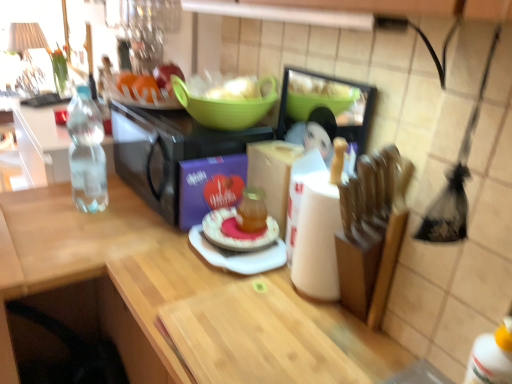
The width and height of the screenshot is (512, 384). Describe the element at coordinates (87, 153) in the screenshot. I see `clear plastic bottle at left` at that location.

From the picture: In order to face wooden cutting board at center, acting as the first appliance starting from the right, should I rotate leftwards or rightwards?

You should look right and rotate roughly 7.252 degrees.

Identify the location of green plastic bowl at upper center. (224, 108).

Describe the element at coordinates (242, 224) in the screenshot. I see `pink glossy plate at center` at that location.

What do you see at coordinates (95, 277) in the screenshot?
I see `wooden cutting board at center` at bounding box center [95, 277].

At what (x,y) coordinates should I click in order to perform the action: click on clear plastic bottle at left. Please return your answer as a coordinate pair (x, y). The width and height of the screenshot is (512, 384). Looking at the image, I should click on (87, 153).

Considering the positions of objects clear plastic bottle at left and wooden cutting board at center, acting as the first appliance starting from the right, in the image provided, who is more to the left, clear plastic bottle at left or wooden cutting board at center, acting as the first appliance starting from the right,?

clear plastic bottle at left is more to the left.

Identify the location of bottle beneath the wooden cutting board at center, acting as the second appliance starting from the left (from a real-world perspective). This screenshot has height=384, width=512. point(87,153).

Can you confirm if clear plastic bottle at left is bigger than wooden cutting board at center, acting as the second appliance starting from the left?

Correct, clear plastic bottle at left is larger in size than wooden cutting board at center, acting as the second appliance starting from the left.

Measure the distance from clear plastic bottle at left to wooden cutting board at center, acting as the first appliance starting from the right.

The distance of clear plastic bottle at left from wooden cutting board at center, acting as the first appliance starting from the right, is 23.27 inches.

Consider the image. Could you tell me if wooden cutting board at center, acting as the first appliance starting from the right, is turned towards wooden cutting board at center?

No, wooden cutting board at center, acting as the first appliance starting from the right, is not oriented towards wooden cutting board at center.

From the image's perspective, relative to wooden cutting board at center, is wooden cutting board at center, acting as the first appliance starting from the right, above or below?

Clearly, from the image's perspective, wooden cutting board at center, acting as the first appliance starting from the right, is above wooden cutting board at center.

Considering the relative sizes of wooden cutting board at center, acting as the second appliance starting from the left, and wooden cutting board at center in the image provided, is wooden cutting board at center, acting as the second appliance starting from the left, bigger than wooden cutting board at center?

No, wooden cutting board at center, acting as the second appliance starting from the left, is not bigger than wooden cutting board at center.

From the wooden cutting board at center, count 2nd appliance to the right and point to it. Please provide its 2D coordinates.

[(325, 112)]

Looking at this image, from the image's perspective, would you say wooden cutting board at center is shown under black matte microwave at center, which is counted as the first appliance, starting from the left?

Indeed, from the image's perspective, wooden cutting board at center is shown beneath black matte microwave at center, which is counted as the first appliance, starting from the left.

Looking at the image, does wooden cutting board at center seem bigger or smaller compared to black matte microwave at center, which is counted as the first appliance, starting from the left?

wooden cutting board at center is bigger than black matte microwave at center, which is counted as the first appliance, starting from the left.

Are wooden cutting board at center and black matte microwave at center, which is the second appliance in right-to-left order, located far from each other?

No, wooden cutting board at center is not far away from black matte microwave at center, which is the second appliance in right-to-left order.

Does point (149, 284) lie in front of point (172, 144)?

Yes.

How different are the orientations of pink glossy plate at center and clear plastic bottle at left in degrees?

The angle between the facing direction of pink glossy plate at center and the facing direction of clear plastic bottle at left is 87.2 degrees.

Is the position of pink glossy plate at center less distant than that of clear plastic bottle at left?

Yes, the depth of pink glossy plate at center is less than that of clear plastic bottle at left.

Is pink glossy plate at center shorter than clear plastic bottle at left?

Yes.

From a real-world perspective, is pink glossy plate at center over clear plastic bottle at left?

Incorrect, from a real-world perspective, pink glossy plate at center is lower than clear plastic bottle at left.

What's the angular difference between green plastic bowl at upper center and clear plastic bottle at left's facing directions?

green plastic bowl at upper center and clear plastic bottle at left are facing 90 degrees away from each other.

Is point (191, 101) closer or farther from the camera than point (77, 130)?

Point (191, 101) is closer to the camera than point (77, 130).

From a real-world perspective, which object rests below the other?

In real-world perspective, clear plastic bottle at left is lower.

Is green plastic bowl at upper center behind clear plastic bottle at left?

No, it is not.

From the image's perspective, is black matte microwave at center, which is counted as the first appliance, starting from the left, located beneath clear plastic bottle at left?

Indeed, from the image's perspective, black matte microwave at center, which is counted as the first appliance, starting from the left, is shown beneath clear plastic bottle at left.

Considering the sizes of objects black matte microwave at center, which is counted as the first appliance, starting from the left, and clear plastic bottle at left in the image provided, who is wider, black matte microwave at center, which is counted as the first appliance, starting from the left, or clear plastic bottle at left?

black matte microwave at center, which is counted as the first appliance, starting from the left, is wider.

Would you consider black matte microwave at center, which is counted as the first appliance, starting from the left, to be distant from clear plastic bottle at left?

black matte microwave at center, which is counted as the first appliance, starting from the left, is actually quite close to clear plastic bottle at left.

Between black matte microwave at center, which is the second appliance in right-to-left order, and clear plastic bottle at left, which one has less height?

Standing shorter between the two is black matte microwave at center, which is the second appliance in right-to-left order.

Where is `bottle above the wooden cutting board at center (from the image's perspective)`? This screenshot has height=384, width=512. bottle above the wooden cutting board at center (from the image's perspective) is located at coordinates click(87, 153).

Which object is closer to the camera taking this photo, clear plastic bottle at left or wooden cutting board at center?

Positioned in front is wooden cutting board at center.

Looking at this image, could you tell me if clear plastic bottle at left is facing wooden cutting board at center?

No, clear plastic bottle at left does not turn towards wooden cutting board at center.

Considering the relative positions of clear plastic bottle at left and wooden cutting board at center in the image provided, is clear plastic bottle at left to the left of wooden cutting board at center from the viewer's perspective?

Indeed, clear plastic bottle at left is positioned on the left side of wooden cutting board at center.

The height and width of the screenshot is (384, 512). I want to click on the 2nd appliance below the clear plastic bottle at left (from the image's perspective), so click(x=325, y=112).

From the image's perspective, which appliance is the 1st one above the wooden cutting board at center? Please provide its 2D coordinates.

[(325, 112)]

When comparing their distances from black matte microwave at center, which is counted as the first appliance, starting from the left, does clear plastic bottle at left or wooden cutting board at center, acting as the second appliance starting from the left, seem further?

wooden cutting board at center, acting as the second appliance starting from the left, is further to black matte microwave at center, which is counted as the first appliance, starting from the left.

Looking at the image, which one is located closer to wooden cutting board at center, acting as the first appliance starting from the right, pink glossy plate at center or black matte microwave at center, which is the second appliance in right-to-left order?

pink glossy plate at center is closer to wooden cutting board at center, acting as the first appliance starting from the right.

Which object lies nearer to the anchor point clear plastic bottle at left, wooden cutting board at center or pink glossy plate at center?

wooden cutting board at center is closer to clear plastic bottle at left.

Looking at the image, which one is located further to black matte microwave at center, which is the second appliance in right-to-left order, wooden cutting board at center, acting as the second appliance starting from the left, or wooden cutting board at center?

wooden cutting board at center, acting as the second appliance starting from the left, is positioned further to the anchor black matte microwave at center, which is the second appliance in right-to-left order.

From the image, which object appears to be nearer to wooden cutting board at center, acting as the first appliance starting from the right, black matte microwave at center, which is the second appliance in right-to-left order, or wooden cutting board at center?

black matte microwave at center, which is the second appliance in right-to-left order.

Which object lies nearer to the anchor point wooden cutting board at center, wooden cutting board at center, acting as the second appliance starting from the left, or black matte microwave at center, which is counted as the first appliance, starting from the left?

black matte microwave at center, which is counted as the first appliance, starting from the left, is positioned closer to the anchor wooden cutting board at center.

Considering their positions, is wooden cutting board at center, acting as the second appliance starting from the left, positioned further to clear plastic bottle at left than green plastic bowl at upper center?

Among the two, wooden cutting board at center, acting as the second appliance starting from the left, is located further to clear plastic bottle at left.

Estimate the real-world distances between objects in this image. Which object is further from wooden cutting board at center, green plastic bowl at upper center or wooden cutting board at center, acting as the second appliance starting from the left?

Based on the image, wooden cutting board at center, acting as the second appliance starting from the left, appears to be further to wooden cutting board at center.

The width and height of the screenshot is (512, 384). Find the location of `bowl located between clear plastic bottle at left and wooden cutting board at center, acting as the first appliance starting from the right, in the left-right direction`. bowl located between clear plastic bottle at left and wooden cutting board at center, acting as the first appliance starting from the right, in the left-right direction is located at coordinates (224, 108).

Where is `appliance located between clear plastic bottle at left and green plastic bowl at upper center in the left-right direction`? appliance located between clear plastic bottle at left and green plastic bowl at upper center in the left-right direction is located at coordinates (168, 151).

Locate an element on the screen. meal between black matte microwave at center, which is the second appliance in right-to-left order, and wooden cutting board at center, acting as the first appliance starting from the right is located at coordinates (242, 224).

Find the location of a particular element. This screenshot has width=512, height=384. appliance between clear plastic bottle at left and wooden cutting board at center, acting as the second appliance starting from the left, from left to right is located at coordinates (168, 151).